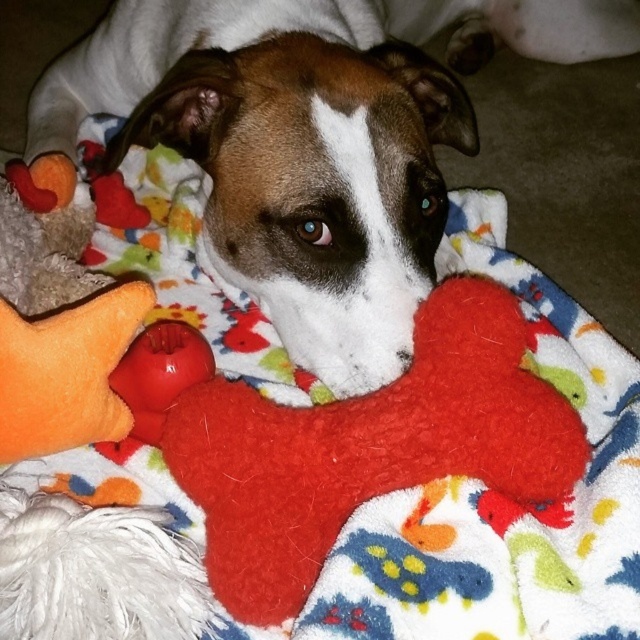
Who is positioned more to the left, fuzzy red bone at center or rubber ball at center?

rubber ball at center is more to the left.

Locate an element on the screen. The width and height of the screenshot is (640, 640). fuzzy red bone at center is located at coordinates (371, 448).

Does orange plush star at lower left appear under rubber ball at center?

Actually, orange plush star at lower left is above rubber ball at center.

Which is in front, point (44, 428) or point (134, 410)?

Point (44, 428) is more forward.

Does point (122, 324) come in front of point (172, 362)?

Yes.

Identify the location of orange plush star at lower left. (67, 372).

From the picture: Between matte orange plush toy at lower left and rubber ball at center, which one appears on the right side from the viewer's perspective?

matte orange plush toy at lower left

Does matte orange plush toy at lower left appear on the right side of rubber ball at center?

Indeed, matte orange plush toy at lower left is positioned on the right side of rubber ball at center.

Between point (472, 12) and point (209, 353), which one is positioned in front?

Point (209, 353) is more forward.

Identify the location of matte orange plush toy at lower left. (312, 141).